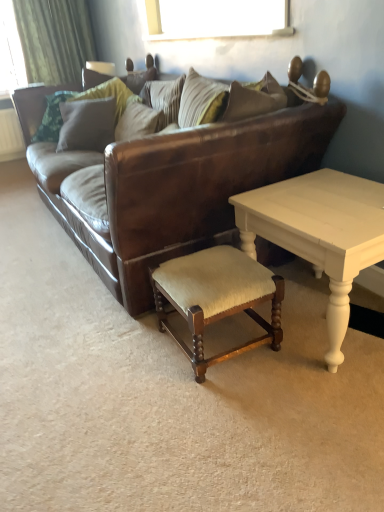
Where is `vacant space that is in between wooden upholstered stool at lower center and white painted wood coffee table at right`? vacant space that is in between wooden upholstered stool at lower center and white painted wood coffee table at right is located at coordinates (268, 374).